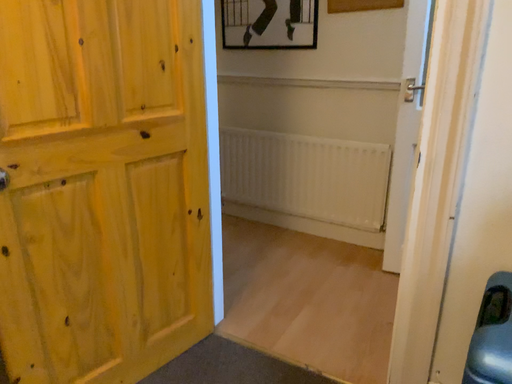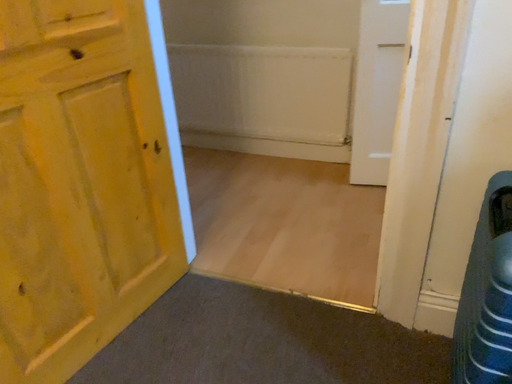
Question: Which way did the camera rotate in the video?

Choices:
 (A) rotated left
 (B) rotated right

Answer: (B)